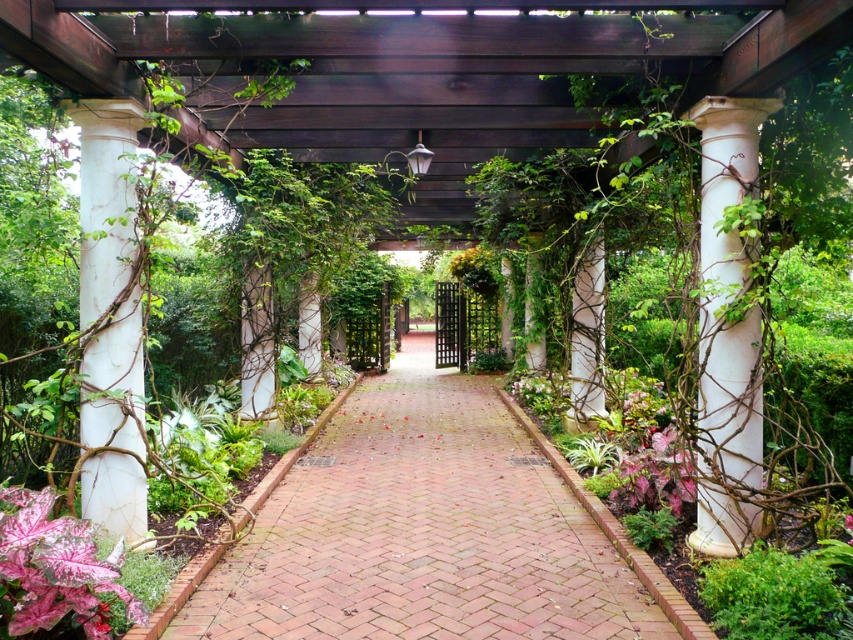
Can you confirm if white marble column at center is wider than pink matte leaf at lower right?

No.

Can you confirm if white marble column at center is positioned above pink matte leaf at lower right?

Yes, white marble column at center is above pink matte leaf at lower right.

Is point (589, 396) closer to viewer compared to point (666, 484)?

No, it is behind (666, 484).

Where is `white marble column at center`? This screenshot has width=853, height=640. white marble column at center is located at coordinates (585, 340).

Between pink variegated leaf at lower left and pink matte leaf at lower right, which one has more height?

Standing taller between the two is pink variegated leaf at lower left.

Is pink variegated leaf at lower left to the left of pink matte leaf at lower right from the viewer's perspective?

Yes, pink variegated leaf at lower left is to the left of pink matte leaf at lower right.

Which is in front, point (45, 536) or point (648, 500)?

Positioned in front is point (45, 536).

What are the coordinates of `pink variegated leaf at lower left` in the screenshot? It's located at (54, 572).

Can you confirm if white marble column at right is positioned to the right of pink matte leaf at lower right?

Incorrect, white marble column at right is not on the right side of pink matte leaf at lower right.

Is white marble column at right behind pink matte leaf at lower right?

That is False.

Who is more distant from viewer, (x=743, y=120) or (x=628, y=461)?

The point (x=628, y=461) is more distant.

At what (x,y) coordinates should I click in order to perform the action: click on white marble column at right. Please return your answer as a coordinate pair (x, y). This screenshot has width=853, height=640. Looking at the image, I should click on (727, 330).